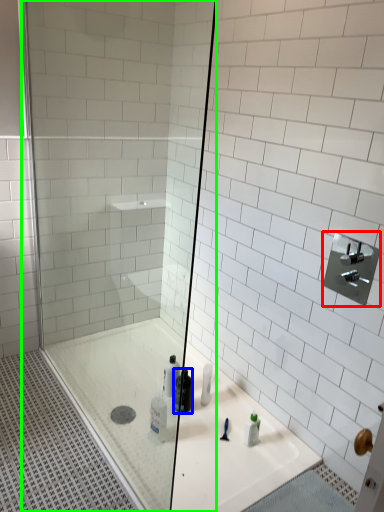
Question: Based on their relative distances, which object is farther from shower (highlighted by a red box)? Choose from mouthwash (highlighted by a blue box) and shower door (highlighted by a green box).

Choices:
 (A) mouthwash
 (B) shower door

Answer: (B)